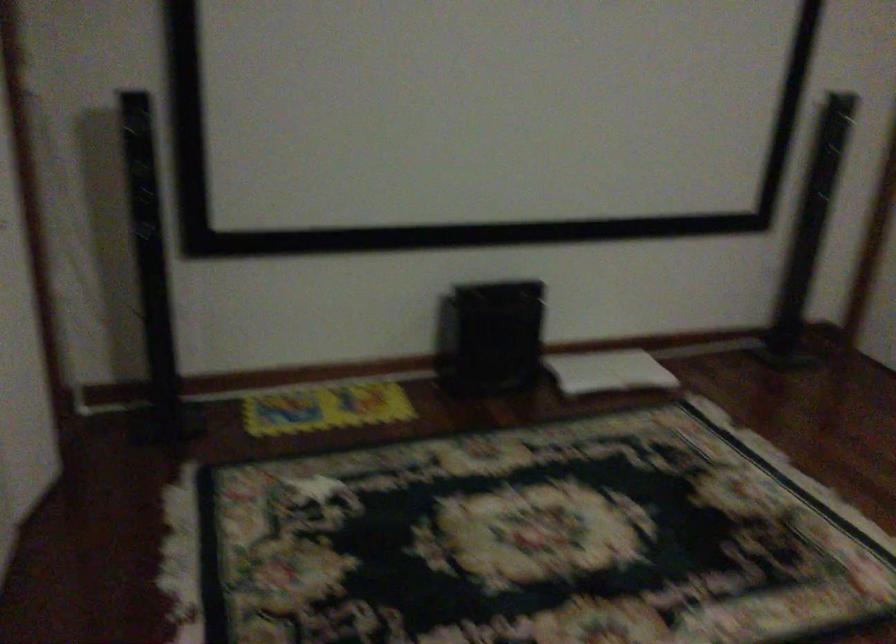
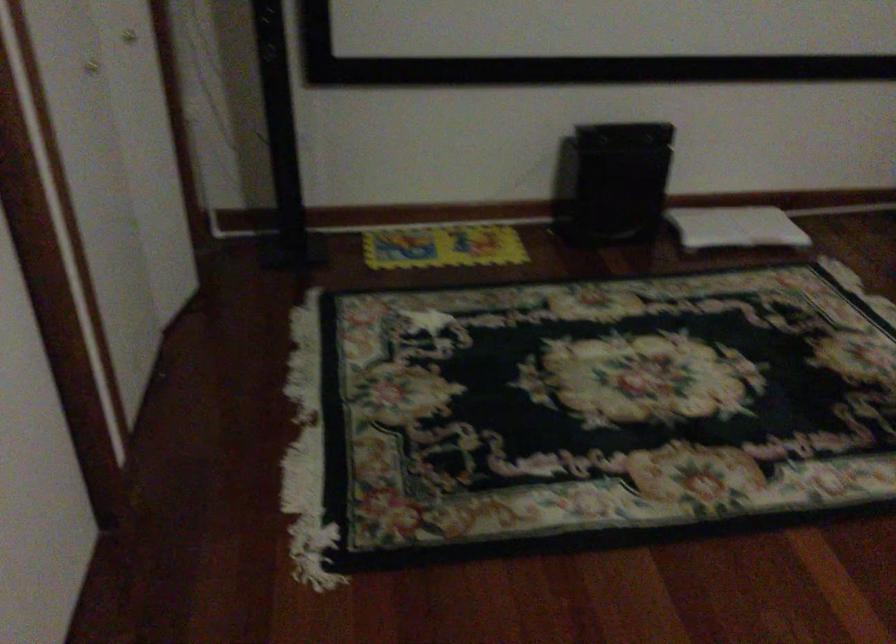
Where in the second image is the point corresponding to point 607,375 from the first image?

(735, 227)